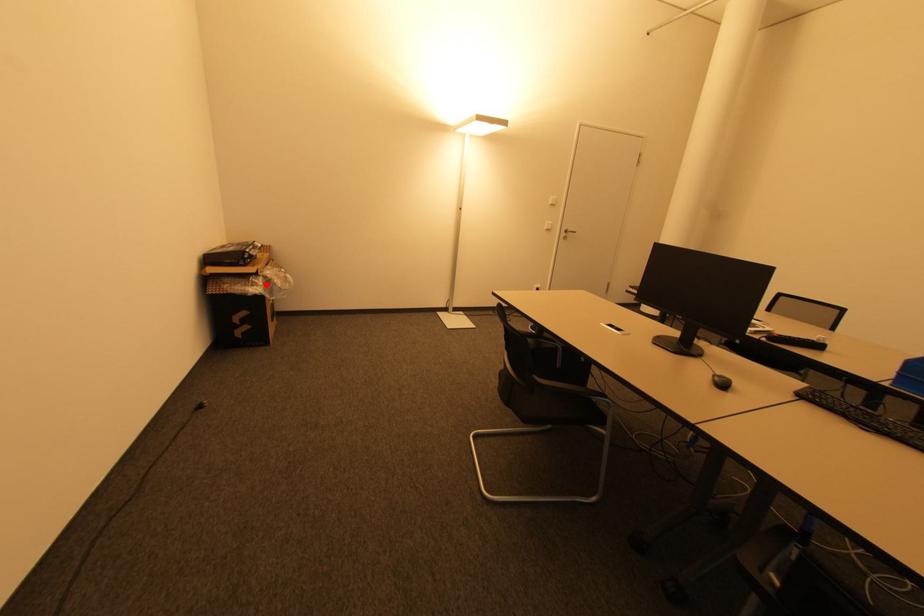
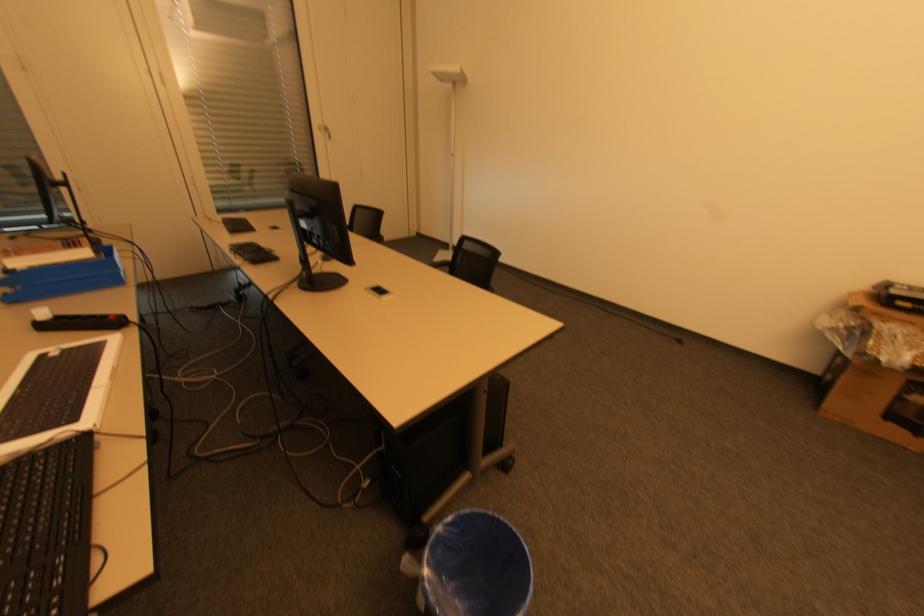
Question: I am providing you with two images of the same scene from different viewpoints. Given a red point in image1, look at the same physical point in image2. Is it:

Choices:
 (A) Closer to the viewpoint
 (B) Farther from the viewpoint

Answer: (B)